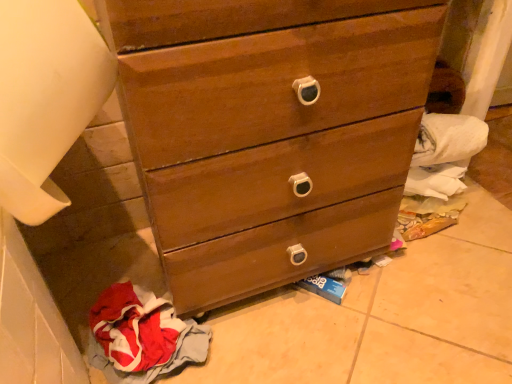
Question: From the image's perspective, is wooden chest of drawers at center located above or below red cotton cloth at lower left?

Choices:
 (A) above
 (B) below

Answer: (A)

Question: Which is correct: wooden chest of drawers at center is inside red cotton cloth at lower left, or outside of it?

Choices:
 (A) outside
 (B) inside

Answer: (A)

Question: Relative to red cotton cloth at lower left, is wooden chest of drawers at center in front or behind?

Choices:
 (A) behind
 (B) front

Answer: (B)

Question: Is red cotton cloth at lower left wider or thinner than wooden chest of drawers at center?

Choices:
 (A) wide
 (B) thin

Answer: (B)

Question: From the image's perspective, is red cotton cloth at lower left positioned above or below wooden chest of drawers at center?

Choices:
 (A) above
 (B) below

Answer: (B)

Question: From their relative heights in the image, would you say red cotton cloth at lower left is taller or shorter than wooden chest of drawers at center?

Choices:
 (A) tall
 (B) short

Answer: (B)

Question: Would you say red cotton cloth at lower left is inside or outside wooden chest of drawers at center?

Choices:
 (A) outside
 (B) inside

Answer: (A)